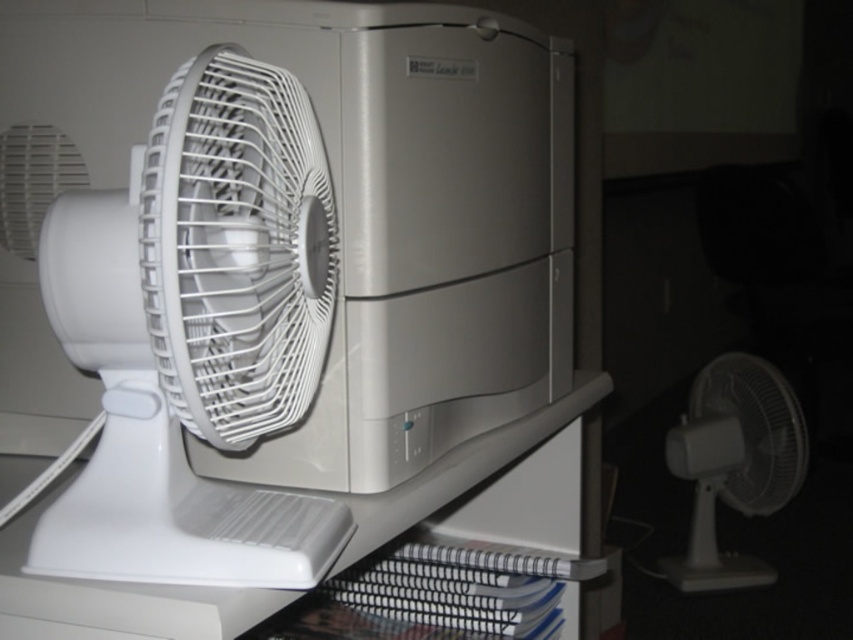
You are standing in front of a desk with a white oscillating fan and some notebooks. There is a specific point at coordinates (198, 333). What object is located at that point?

The white plastic fan at left is located at point (198, 333).

Looking at this image, you are organizing a desk and see two white plastic fans on it. Which one is nearer to you, the white plastic fan at left or the white plastic fan at lower right?

The white plastic fan at left is closer to the viewer than the white plastic fan at lower right, so the white plastic fan at left is nearer to you.